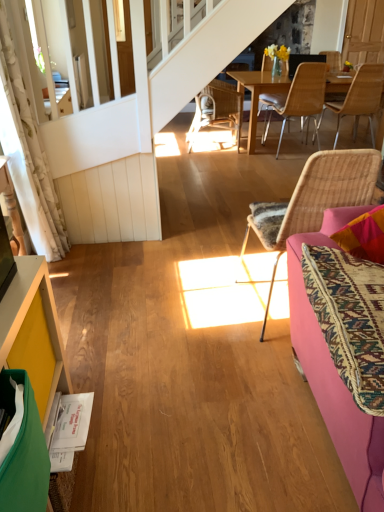
Where is `vacant region under white floral fabric curtain at left (from a real-world perspective)`? vacant region under white floral fabric curtain at left (from a real-world perspective) is located at coordinates (65, 253).